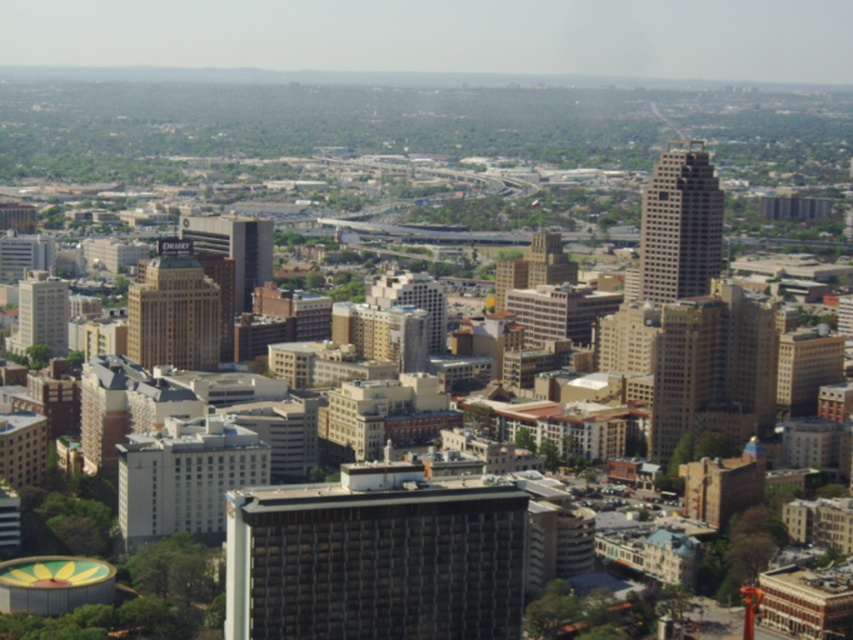
Question: In this image, where is matte glass skyscraper at center located relative to beige concrete building at left?

Choices:
 (A) left
 (B) right

Answer: (B)

Question: Which is farther from the matte glass skyscraper at center?

Choices:
 (A) brown brick building at center
 (B) gray concrete skyscraper at upper right
 (C) brown brick building at center-left

Answer: (A)

Question: Observing the image, what is the correct spatial positioning of dark gray concrete building at center in reference to matte glass skyscraper at center?

Choices:
 (A) left
 (B) right

Answer: (B)

Question: Based on their relative distances, which object is farther from the matte glass skyscraper at center?

Choices:
 (A) matte white building at center
 (B) dark gray concrete building at center

Answer: (B)

Question: Estimate the real-world distances between objects in this image. Which object is farther from the matte white building at center?

Choices:
 (A) brown brick building at center
 (B) beige concrete building at left

Answer: (B)

Question: Is brown brick building at center-left above beige concrete building at left?

Choices:
 (A) no
 (B) yes

Answer: (B)